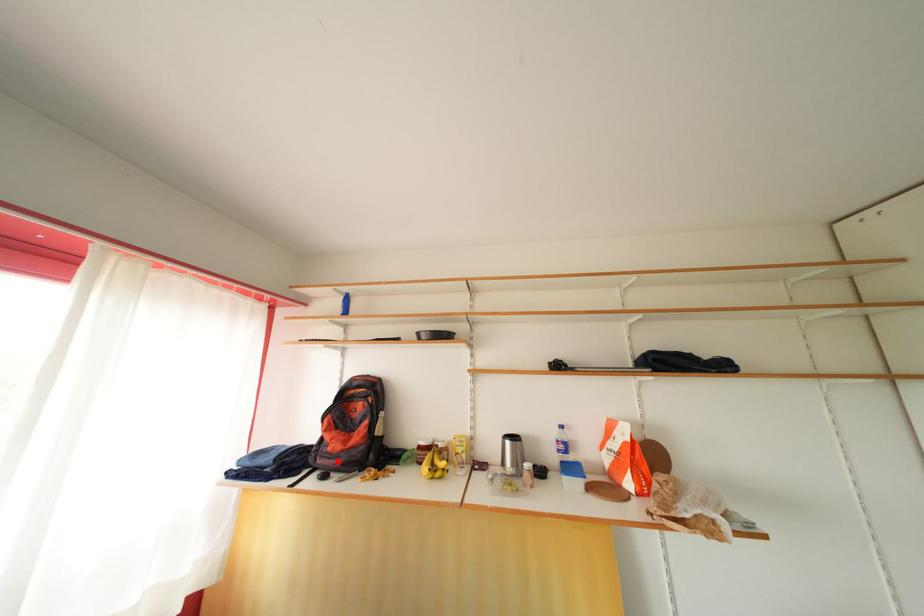
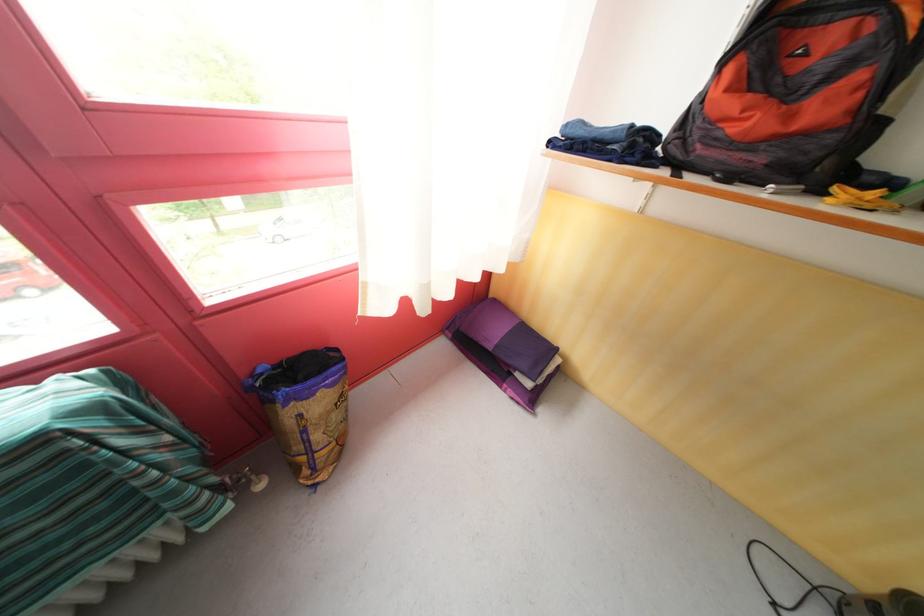
The point at the highlighted location is marked in the first image. Where is the corresponding point in the second image?

(736, 151)